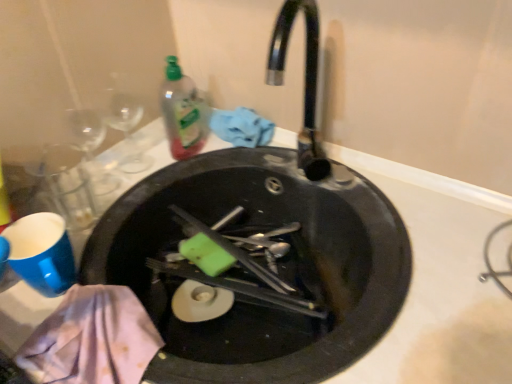
Where is `black matte sink at center`? Image resolution: width=512 pixels, height=384 pixels. black matte sink at center is located at coordinates (261, 252).

What do you see at coordinates (261, 252) in the screenshot? Image resolution: width=512 pixels, height=384 pixels. I see `black matte sink at center` at bounding box center [261, 252].

What do you see at coordinates (183, 112) in the screenshot? I see `translucent plastic bottle at upper center` at bounding box center [183, 112].

Where is `translucent plastic bottle at upper center`? The width and height of the screenshot is (512, 384). translucent plastic bottle at upper center is located at coordinates (183, 112).

The image size is (512, 384). In order to click on black matte sink at center in this screenshot , I will do `click(261, 252)`.

Would you say black matte sink at center is to the left or to the right of translucent plastic bottle at upper center in the picture?

Based on their positions, black matte sink at center is located to the right of translucent plastic bottle at upper center.

Is black matte sink at center closer to camera compared to translucent plastic bottle at upper center?

Yes, the depth of black matte sink at center is less than that of translucent plastic bottle at upper center.

Is point (345, 166) closer to camera compared to point (164, 105)?

Yes, it is in front of point (164, 105).

From the image's perspective, is black matte sink at center above translucent plastic bottle at upper center?

Incorrect, from the image's perspective, black matte sink at center is lower than translucent plastic bottle at upper center.

From a real-world perspective, which object stands above the other?

From a 3D spatial view, translucent plastic bottle at upper center is above.

Considering the relative sizes of black matte sink at center and translucent plastic bottle at upper center in the image provided, is black matte sink at center wider than translucent plastic bottle at upper center?

Yes.

Looking at this image, from their relative heights in the image, would you say black matte sink at center is taller or shorter than translucent plastic bottle at upper center?

black matte sink at center is shorter than translucent plastic bottle at upper center.

Considering the relative sizes of black matte sink at center and translucent plastic bottle at upper center in the image provided, is black matte sink at center smaller than translucent plastic bottle at upper center?

No, black matte sink at center is not smaller than translucent plastic bottle at upper center.

Is black matte sink at center spatially inside translucent plastic bottle at upper center, or outside of it?

The correct answer is: outside.

In the scene shown: Is there a large distance between black matte sink at center and translucent plastic bottle at upper center?

No, there isn't a large distance between black matte sink at center and translucent plastic bottle at upper center.

Is black matte sink at center facing towards translucent plastic bottle at upper center?

No, black matte sink at center does not turn towards translucent plastic bottle at upper center.

What's the angular difference between black matte sink at center and translucent plastic bottle at upper center's facing directions?

They differ by 104 degrees in their facing directions.

You are a GUI agent. You are given a task and a screenshot of the screen. Output one action in this format:
    pyautogui.click(x=<x>, y=<y>)
    Task: Click on the bottle that appears above the black matte sink at center (from a real-world perspective)
    
    Given the screenshot: What is the action you would take?
    pyautogui.click(x=183, y=112)

Can you confirm if translucent plastic bottle at upper center is positioned to the right of black matte sink at center?

No, translucent plastic bottle at upper center is not to the right of black matte sink at center.

Which is behind, translucent plastic bottle at upper center or black matte sink at center?

translucent plastic bottle at upper center is further from the camera.

Which is further, (185, 132) or (298, 278)?

The point (185, 132) is behind.

From the image's perspective, between translucent plastic bottle at upper center and black matte sink at center, which one is located above?

translucent plastic bottle at upper center.

From a real-world perspective, between translucent plastic bottle at upper center and black matte sink at center, who is vertically lower?

In real-world perspective, black matte sink at center is lower.

Is translucent plastic bottle at upper center wider than black matte sink at center?

No.

Who is taller, translucent plastic bottle at upper center or black matte sink at center?

translucent plastic bottle at upper center.

Is translucent plastic bottle at upper center smaller than black matte sink at center?

Yes.

Is black matte sink at center surrounded by translucent plastic bottle at upper center?

That's incorrect, black matte sink at center is not inside translucent plastic bottle at upper center.

Is translucent plastic bottle at upper center beside black matte sink at center?

No, translucent plastic bottle at upper center is not beside black matte sink at center.

Is translucent plastic bottle at upper center facing towards black matte sink at center?

No, translucent plastic bottle at upper center is not aimed at black matte sink at center.

What's the angular difference between translucent plastic bottle at upper center and black matte sink at center's facing directions?

translucent plastic bottle at upper center and black matte sink at center are facing 104 degrees away from each other.

Identify the location of bottle positioned vertically above the black matte sink at center (from a real-world perspective). (183, 112).

You are a GUI agent. You are given a task and a screenshot of the screen. Output one action in this format:
    pyautogui.click(x=<x>, y=<y>)
    Task: Click on the bottle that is on the left side of black matte sink at center
    This screenshot has height=384, width=512.
    Given the screenshot: What is the action you would take?
    pyautogui.click(x=183, y=112)

You are a GUI agent. You are given a task and a screenshot of the screen. Output one action in this format:
    pyautogui.click(x=<x>, y=<y>)
    Task: Click on the sink on the right of translucent plastic bottle at upper center
    This screenshot has width=512, height=384.
    Given the screenshot: What is the action you would take?
    pyautogui.click(x=261, y=252)